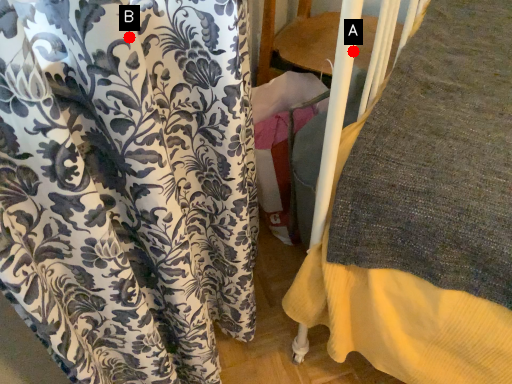
Question: Two points are circled on the image, labeled by A and B beside each circle. Among these points, which one is farthest from the camera?

Choices:
 (A) A is further
 (B) B is further

Answer: (A)